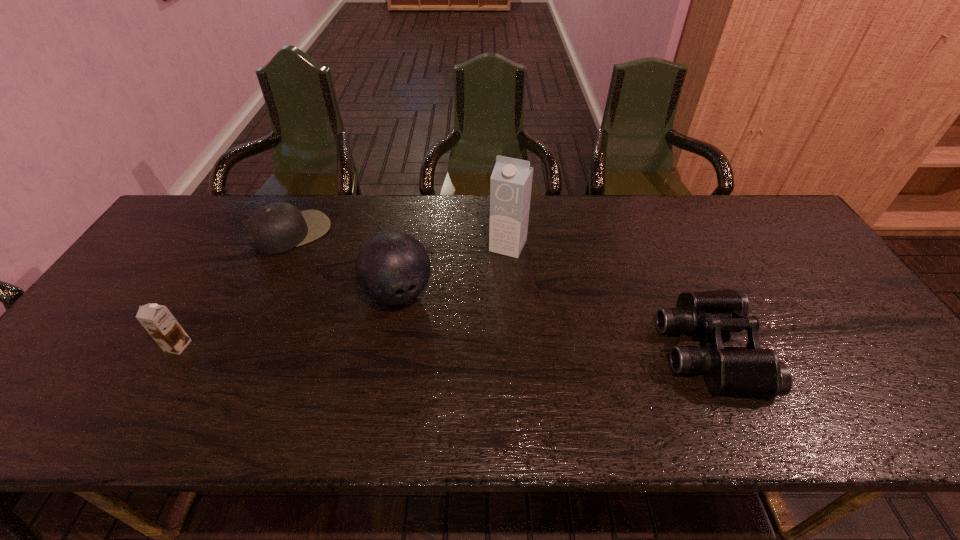
Where is `carton that is at the far edge`? The width and height of the screenshot is (960, 540). carton that is at the far edge is located at coordinates (511, 181).

This screenshot has height=540, width=960. I want to click on object positioned at the near edge, so click(x=753, y=371).

You are a GUI agent. You are given a task and a screenshot of the screen. Output one action in this format:
    pyautogui.click(x=<x>, y=<y>)
    Task: Click on the vacant region at the far edge of the desktop
    The height and width of the screenshot is (540, 960).
    Given the screenshot: What is the action you would take?
    pyautogui.click(x=654, y=211)

The width and height of the screenshot is (960, 540). What are the coordinates of `free space at the near edge of the desktop` in the screenshot? It's located at (828, 362).

You are a GUI agent. You are given a task and a screenshot of the screen. Output one action in this format:
    pyautogui.click(x=<x>, y=<y>)
    Task: Click on the vacant space at the right edge of the desktop
    Image resolution: width=960 pixels, height=540 pixels.
    Given the screenshot: What is the action you would take?
    pyautogui.click(x=793, y=264)

In the image, there is a desktop. Identify the location of blank space at the far left corner. The width and height of the screenshot is (960, 540). (193, 203).

What are the coordinates of `free space at the near left corner of the desktop` in the screenshot? It's located at (97, 390).

This screenshot has height=540, width=960. In order to click on empty space between the leftmost object and the cap in this screenshot , I will do `click(236, 289)`.

The image size is (960, 540). I want to click on free point between the fourth object from right to left and the leftmost object, so click(236, 289).

At what (x,y) coordinates should I click in order to perform the action: click on free spot between the third shortest object and the cap. Please return your answer as a coordinate pair (x, y). This screenshot has width=960, height=540. Looking at the image, I should click on (236, 289).